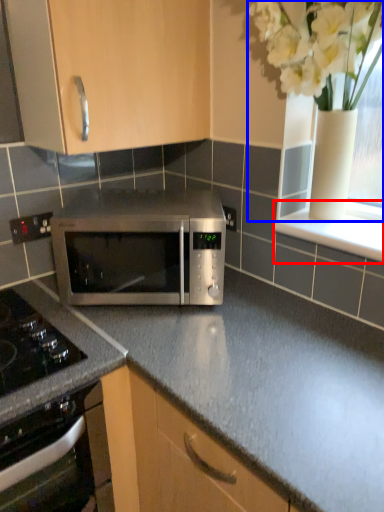
Question: Among these objects, which one is nearest to the camera, window sill (highlighted by a red box) or floral arrangement (highlighted by a blue box)?

Choices:
 (A) window sill
 (B) floral arrangement

Answer: (B)